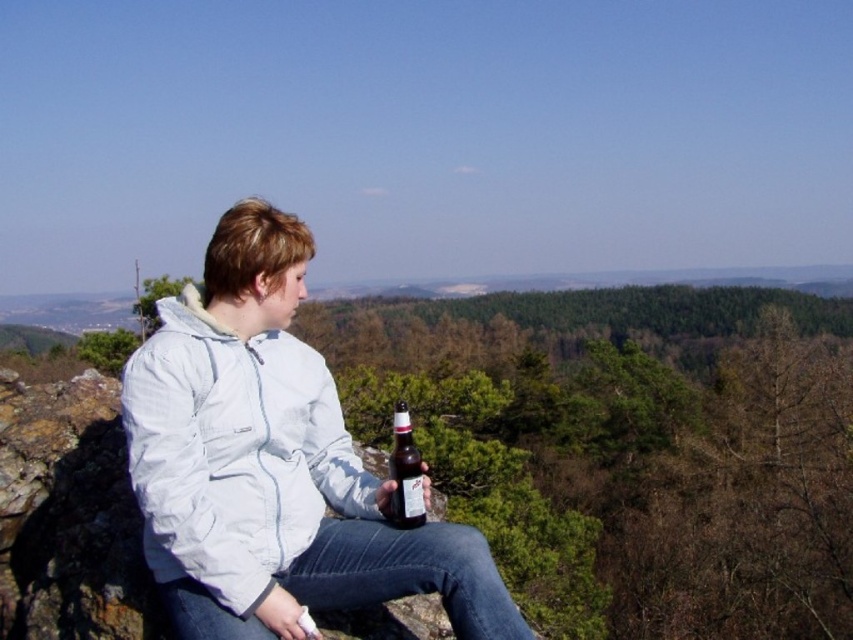
Question: Does white matte jacket at center appear on the right side of white fleece jacket at center?

Choices:
 (A) no
 (B) yes

Answer: (B)

Question: Is white matte jacket at center thinner than white fleece jacket at center?

Choices:
 (A) yes
 (B) no

Answer: (A)

Question: Is white matte jacket at center smaller than brown glass bottle at center?

Choices:
 (A) yes
 (B) no

Answer: (A)

Question: Which point is closer to the camera taking this photo?

Choices:
 (A) (415, 515)
 (B) (125, 426)
 (C) (164, 554)

Answer: (C)

Question: Estimate the real-world distances between objects in this image. Which object is closer to the white matte jacket at center?

Choices:
 (A) white fleece jacket at center
 (B) brown glass bottle at center

Answer: (A)

Question: Which point appears farthest from the camera in this image?

Choices:
 (A) (228, 442)
 (B) (305, 396)
 (C) (397, 525)

Answer: (B)